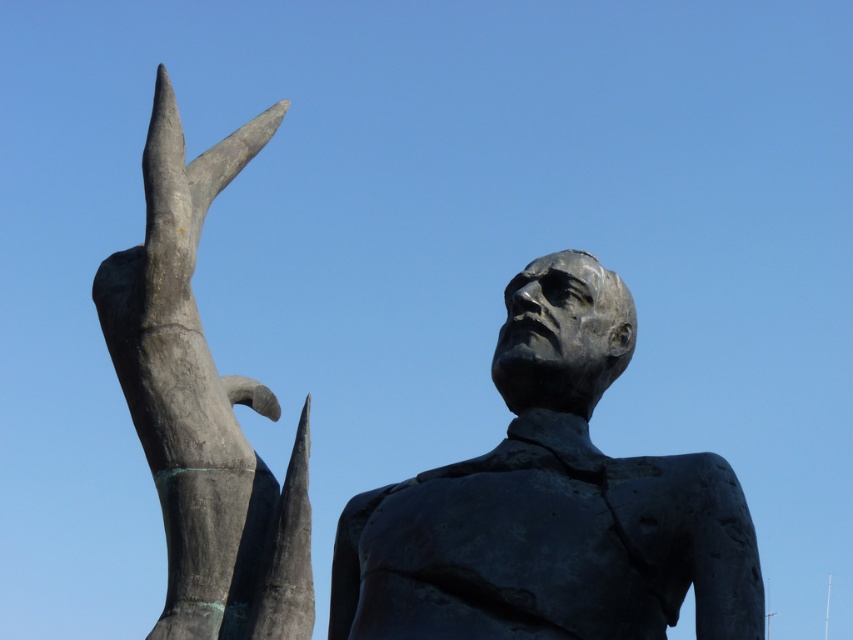
Question: Which object is closer to the camera taking this photo?

Choices:
 (A) bronze statue at upper center
 (B) bronze statue at center
 (C) bronze hand at upper left

Answer: (B)

Question: Considering the relative positions of bronze statue at upper center and bronze hand at upper left in the image provided, where is bronze statue at upper center located with respect to bronze hand at upper left?

Choices:
 (A) left
 (B) right

Answer: (B)

Question: Which is nearer to the bronze hand at upper left?

Choices:
 (A) bronze statue at upper center
 (B) bronze statue at center

Answer: (A)

Question: Does bronze statue at center appear on the left side of bronze hand at upper left?

Choices:
 (A) yes
 (B) no

Answer: (B)

Question: Can you confirm if bronze statue at center is bigger than bronze hand at upper left?

Choices:
 (A) yes
 (B) no

Answer: (B)

Question: Which of the following is the farthest from the observer?

Choices:
 (A) (460, 624)
 (B) (523, 470)
 (C) (158, 296)

Answer: (C)